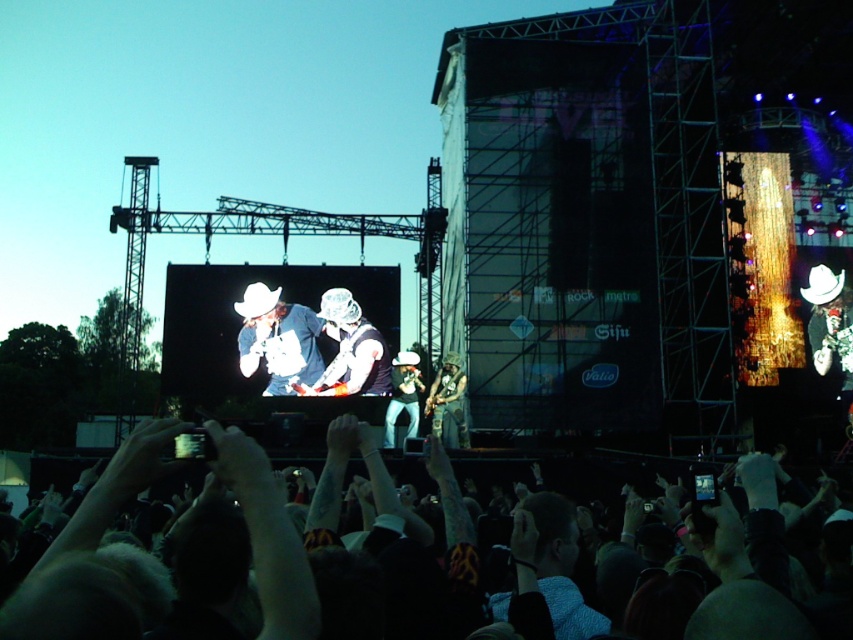
You are standing in the crowd at the concert and want to know which of the two points, point (445, 394) or point (392, 412), is closer to you. Can you determine this based on the scene?

Point (445, 394) is closer to the viewer than point (392, 412).

You are a photographer at the concert and want to capture both the matte white cowboy hat at center and the shiny silver guitar at center in a single frame. Which object will appear wider in your photo?

The matte white cowboy hat at center will appear wider in the photo since its width is larger than that of the shiny silver guitar at center.